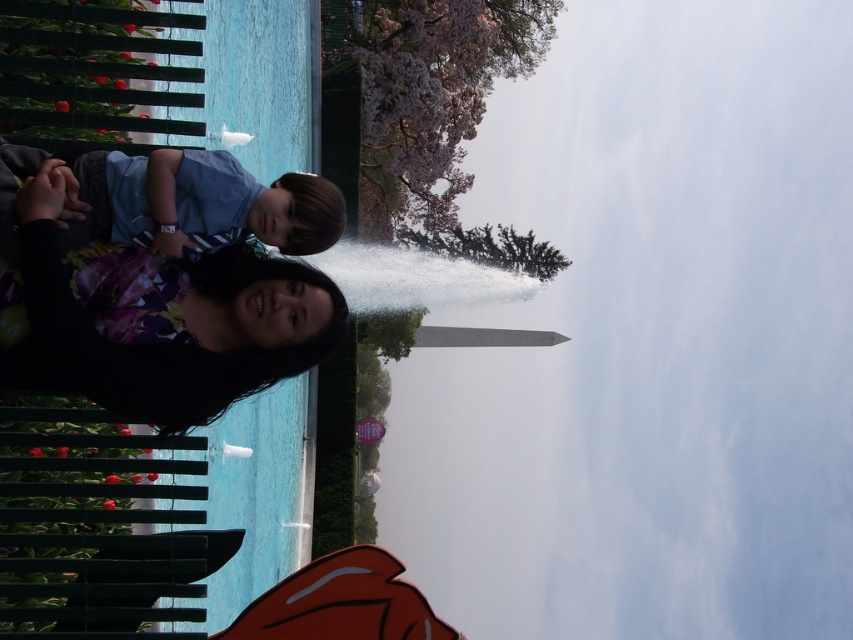
Question: Which object is the closest to the blue striped shirt at left?

Choices:
 (A) clear blue water at center
 (B) black floral dress at lower left

Answer: (B)

Question: Can you confirm if clear blue water at center is positioned to the left of blue striped shirt at left?

Choices:
 (A) no
 (B) yes

Answer: (A)

Question: Which of the following is the farthest from the observer?

Choices:
 (A) black floral dress at lower left
 (B) clear blue water at center

Answer: (B)

Question: Does clear blue water at center have a smaller size compared to black floral dress at lower left?

Choices:
 (A) yes
 (B) no

Answer: (B)

Question: Among these points, which one is farthest from the camera?

Choices:
 (A) (224, 310)
 (B) (550, 355)
 (C) (299, 227)

Answer: (B)

Question: Does clear blue water at center lie in front of blue striped shirt at left?

Choices:
 (A) yes
 (B) no

Answer: (B)